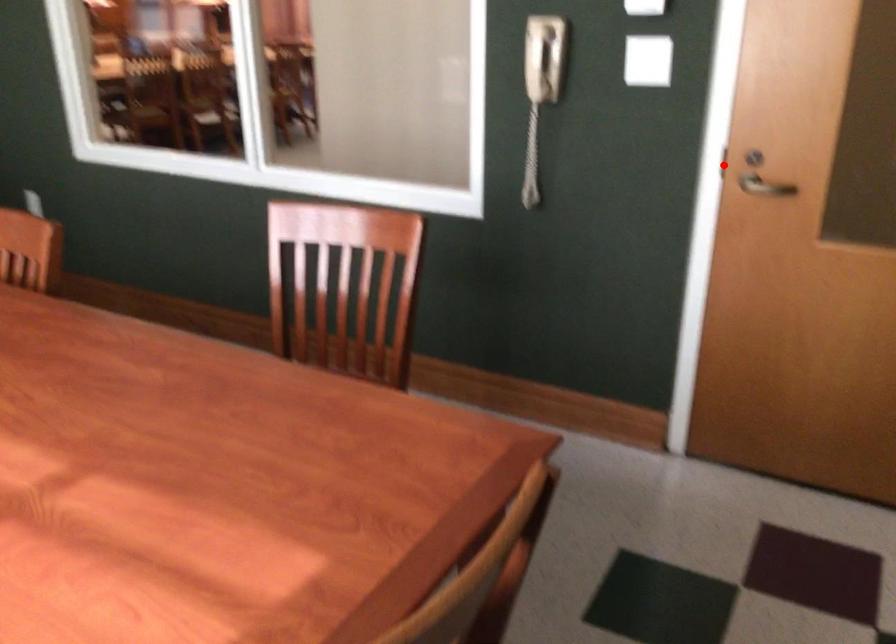
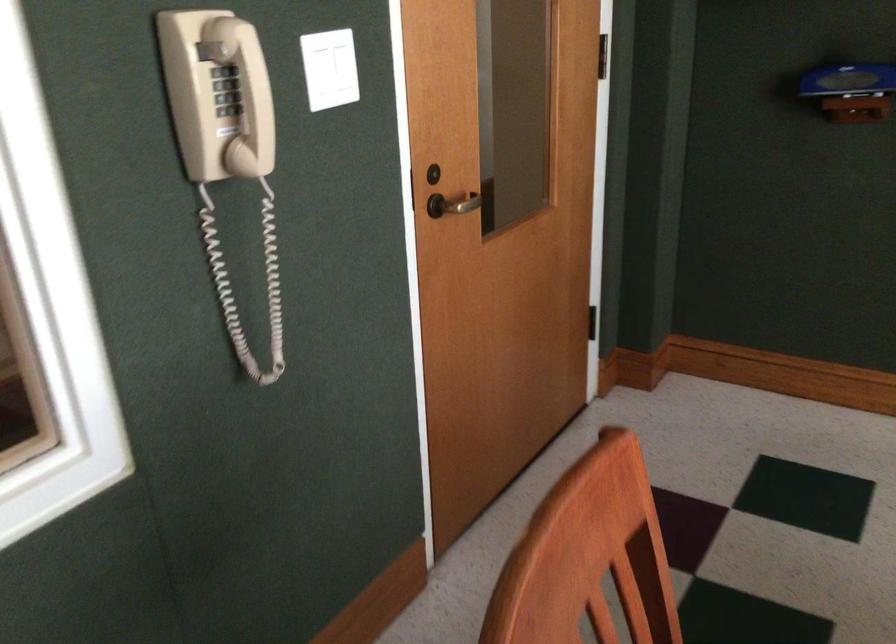
In the second image, find the point that corresponds to the highlighted location in the first image.

(409, 191)